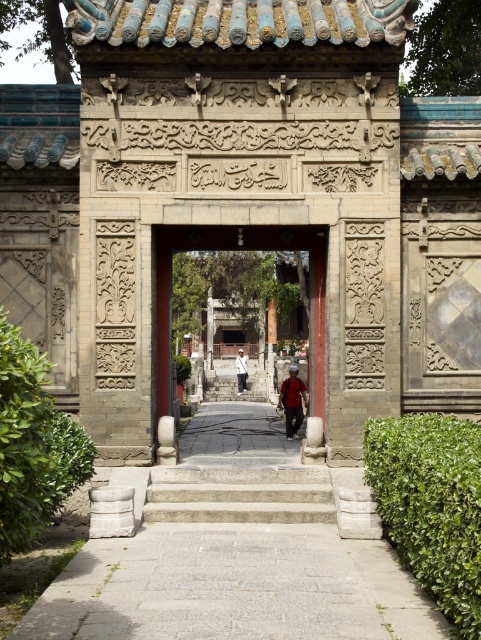
You are standing in front of the traditional Chinese gate. There is a point marked at coordinates [431,506]. Based on the scene description, can you determine what this point is located on?

The point at coordinates [431,506] is located on the green leafy hedge at right.

You are standing in front of a traditional Chinese gate with intricate carvings. You notice a green leafy hedge at lower left and a red fabric backpack at center. Which object is narrower?

The green leafy hedge at lower left is narrower than the red fabric backpack at center.

You are a visitor at this traditional Chinese gate. You notice a green leafy hedge at right and a red fabric backpack at center. Which object is wider?

The green leafy hedge at right is wider than the red fabric backpack at center.